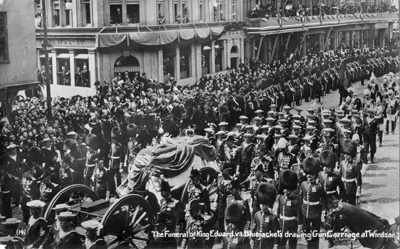
Locate an element on the screen. The image size is (400, 249). ledge is located at coordinates (295, 29).